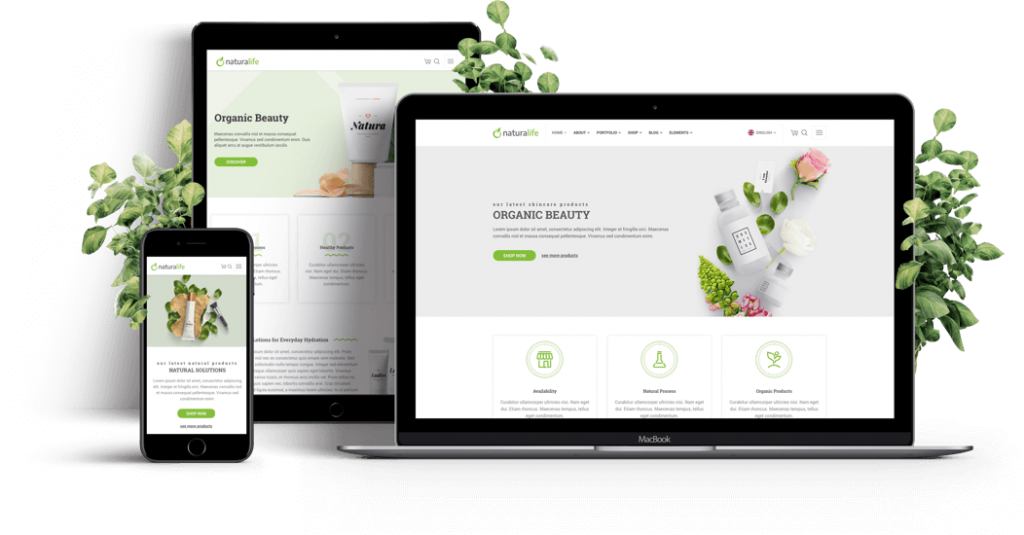
Image resolution: width=1024 pixels, height=535 pixels. I want to click on macbook, so click(x=784, y=105).